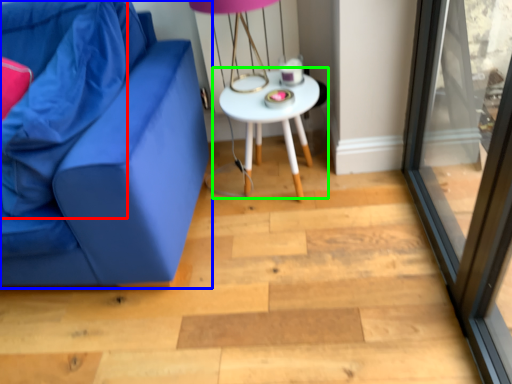
Question: Which is farther away from pillow (highlighted by a red box)? studio couch (highlighted by a blue box) or table (highlighted by a green box)?

Choices:
 (A) studio couch
 (B) table

Answer: (B)